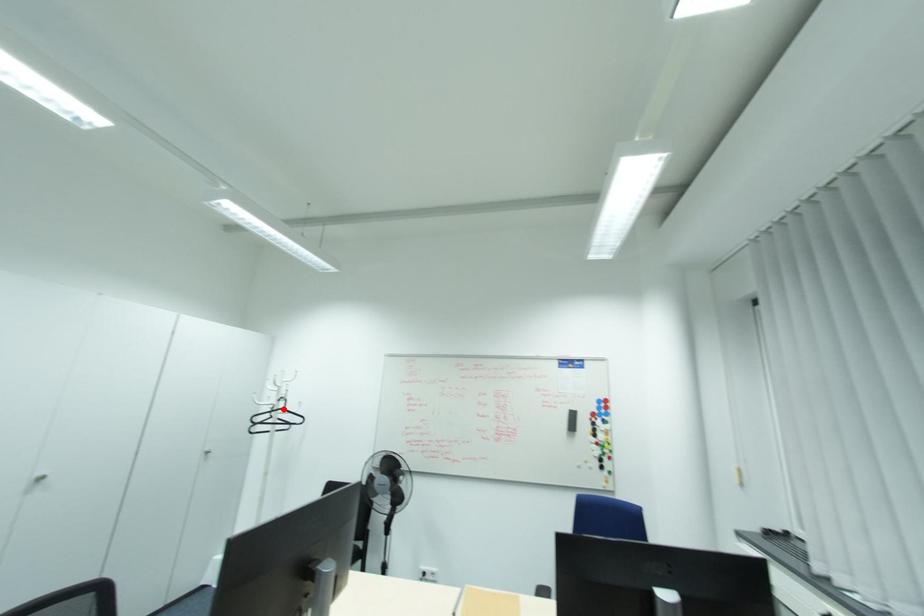
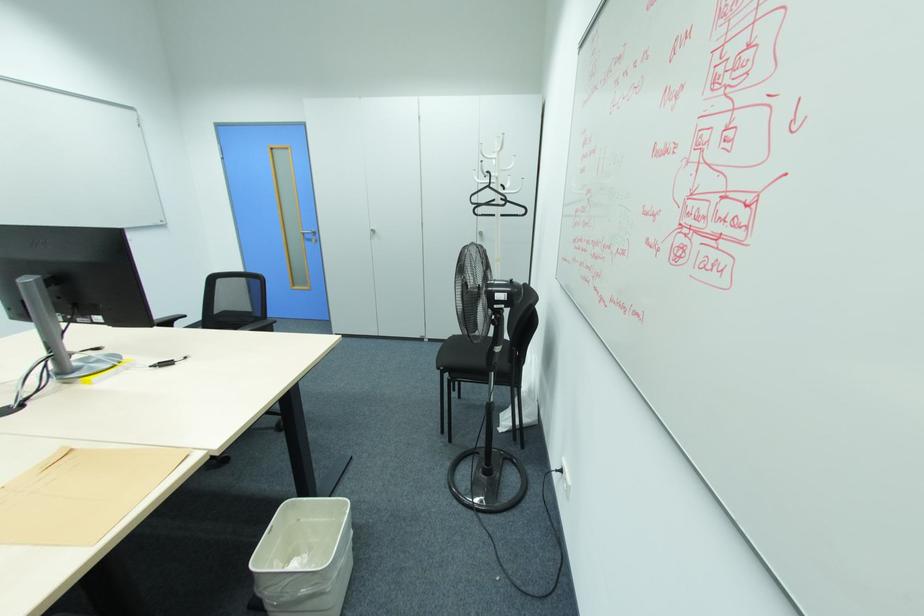
Locate, in the second image, the point that corresponds to the highlighted location in the first image.

(490, 187)